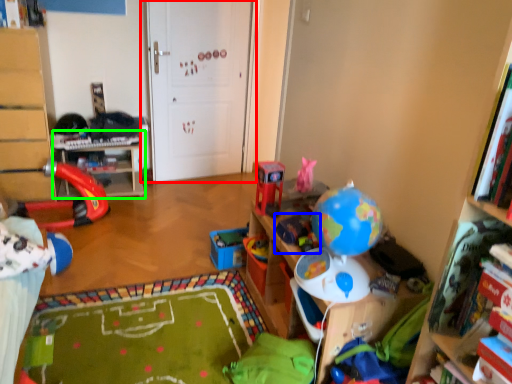
Question: Considering the real-world distances, which object is closest to door (highlighted by a red box)? toy (highlighted by a blue box) or table (highlighted by a green box).

Choices:
 (A) toy
 (B) table

Answer: (B)